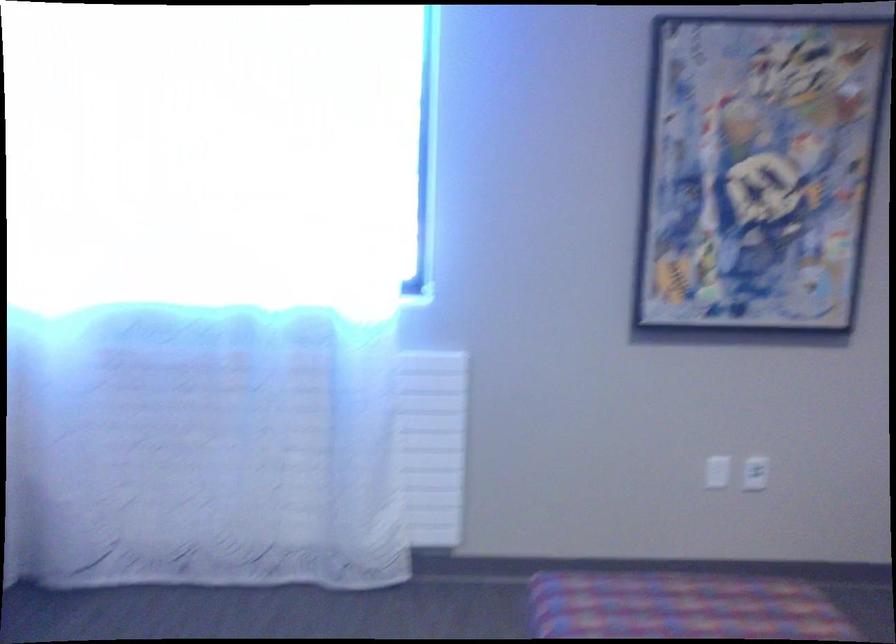
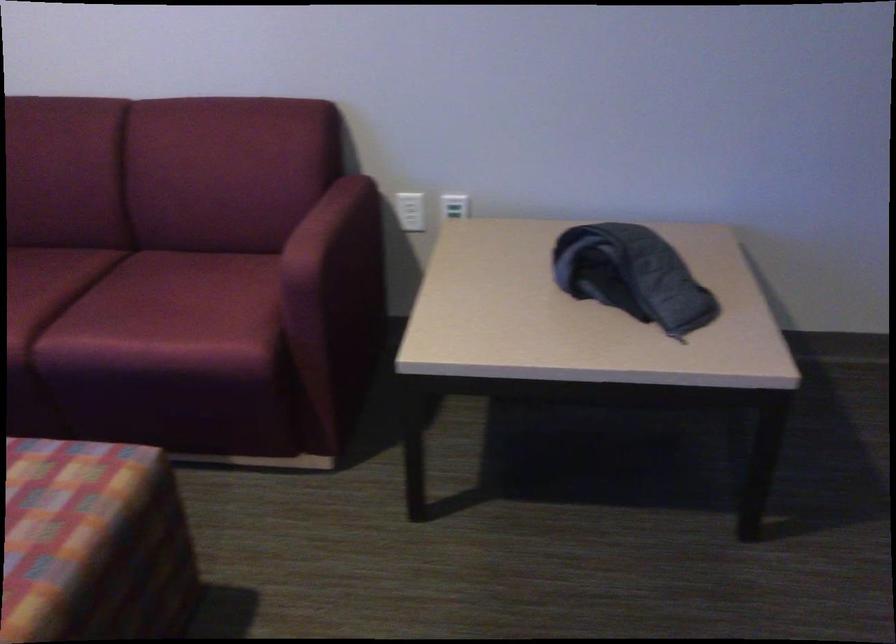
Based on the continuous images, in which direction is the camera rotating?

Result: The camera's rotation is toward right-down.